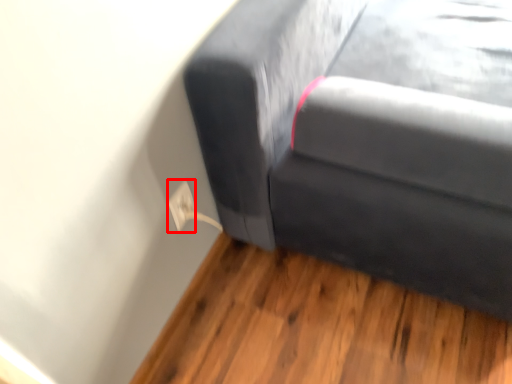
Question: Considering the relative positions of electric outlet (annotated by the red box) and studio couch in the image provided, where is electric outlet (annotated by the red box) located with respect to the staircase?

Choices:
 (A) left
 (B) right

Answer: (A)